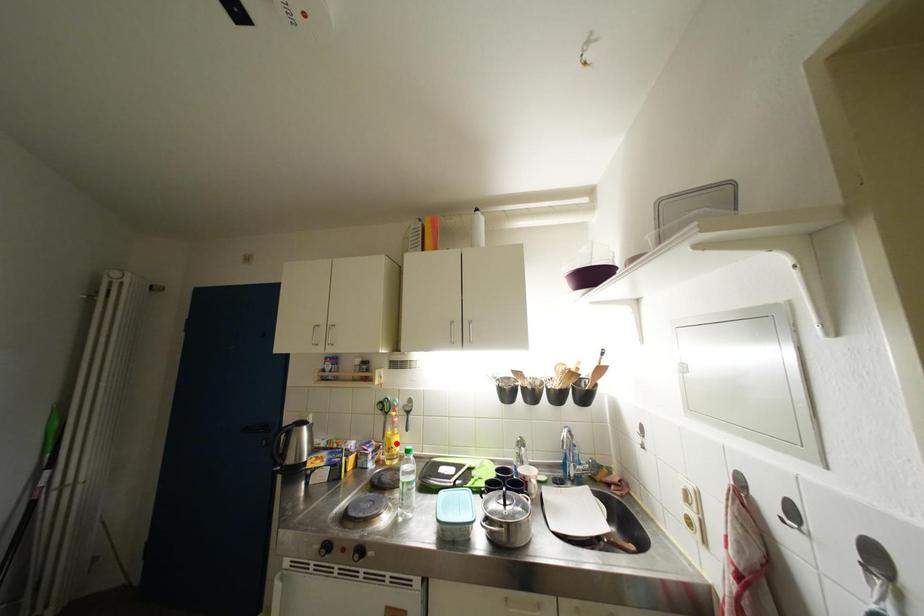
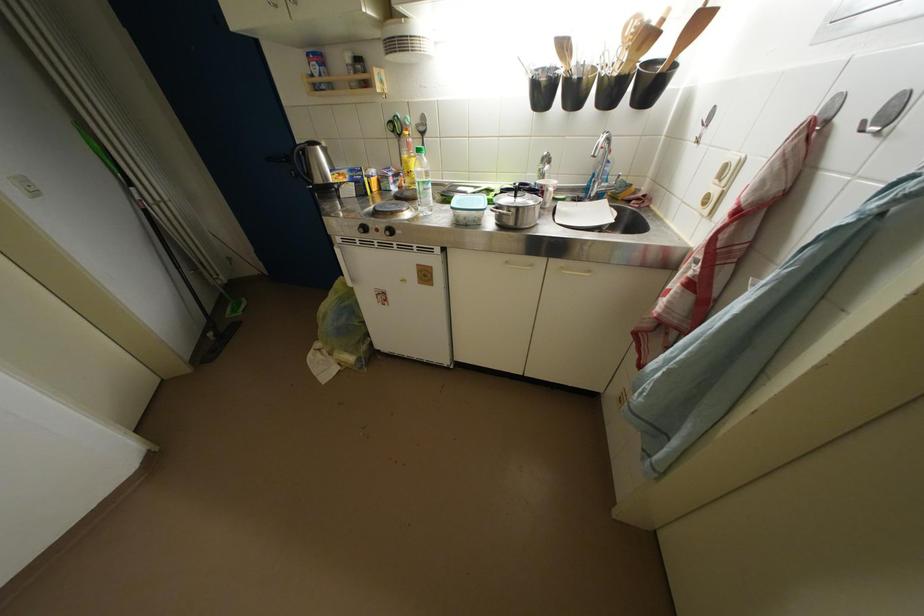
Question: I am providing you with two images of the same scene from different viewpoints. Given a red point in image1, look at the same physical point in image2. Is it:

Choices:
 (A) Closer to the viewpoint
 (B) Farther from the viewpoint

Answer: (A)